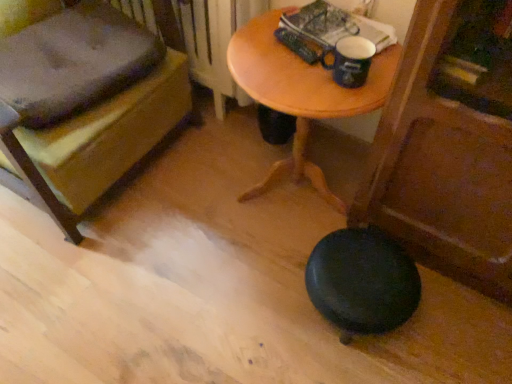
Image resolution: width=512 pixels, height=384 pixels. I want to click on free space in front of blue ceramic mug at upper center, so click(x=342, y=102).